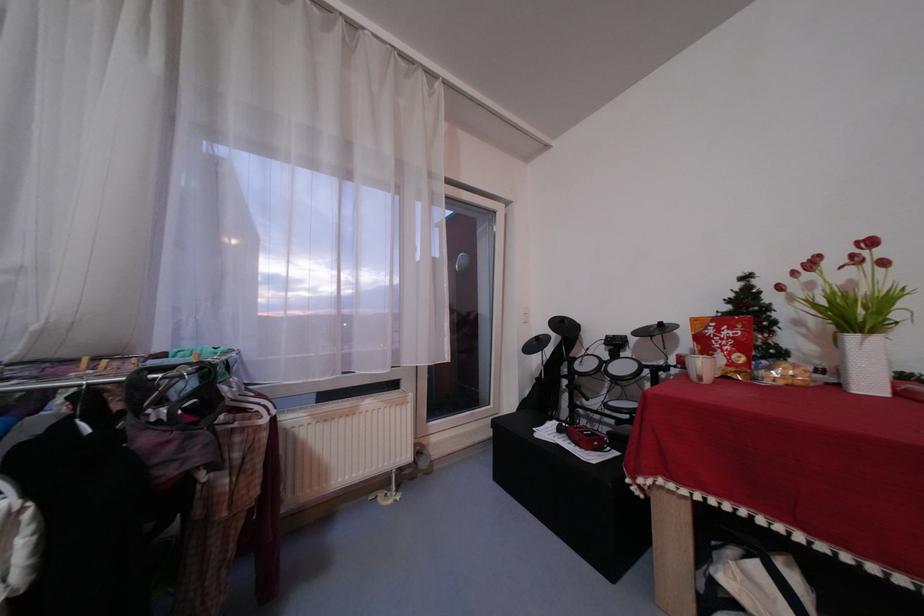
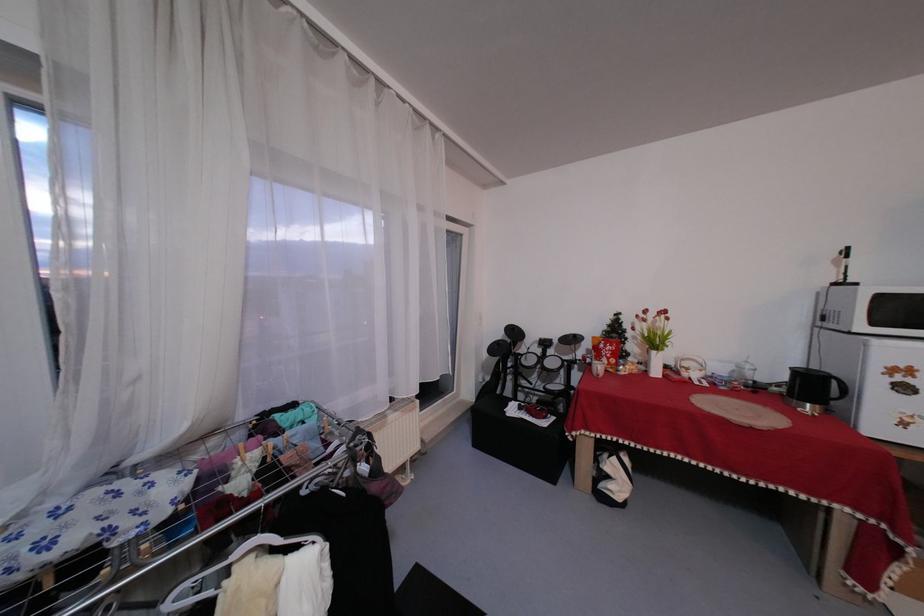
Question: The images are taken continuously from a first-person perspective. In which direction is your viewpoint rotating?

Choices:
 (A) Left
 (B) Right
 (C) Up
 (D) Down

Answer: (B)